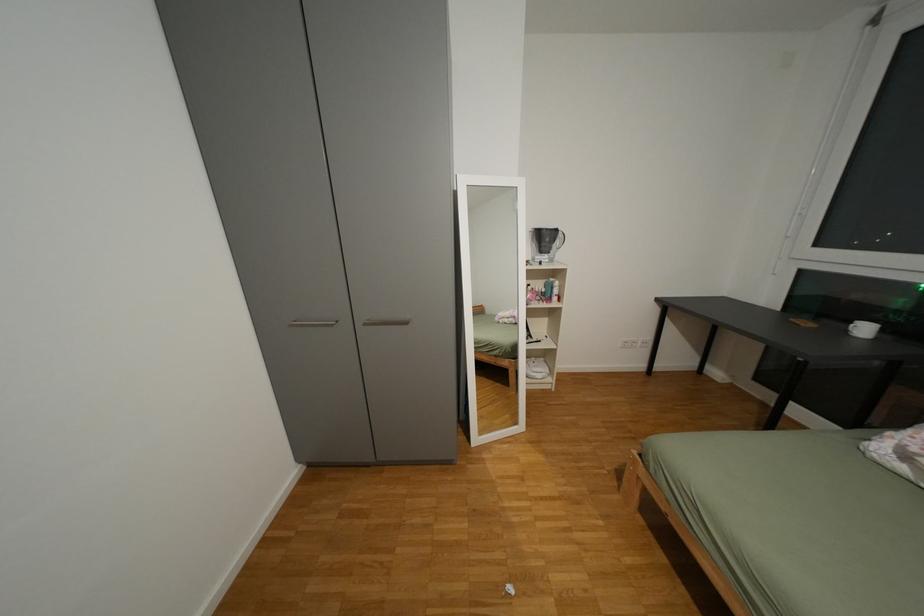
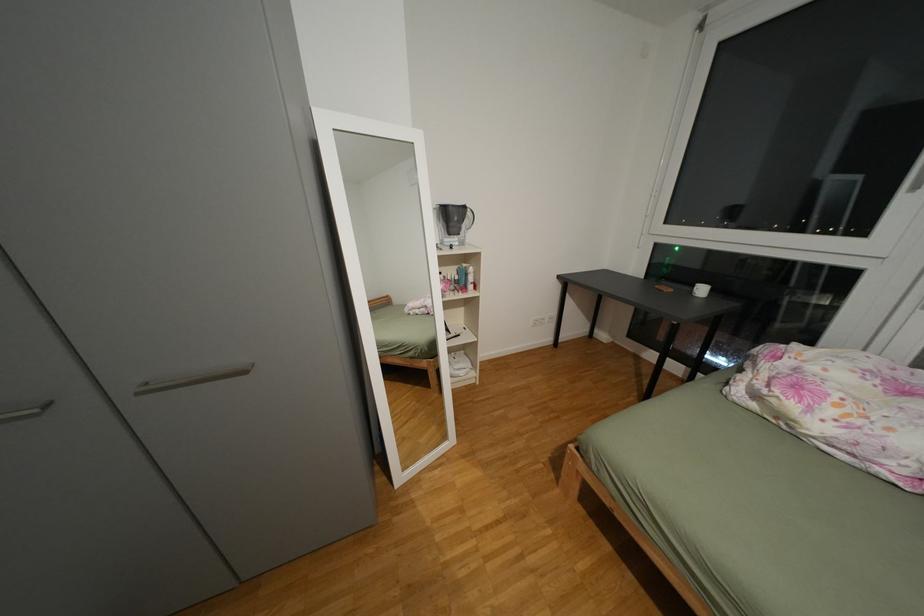
Question: What movement of the cameraman would produce the second image?

Choices:
 (A) Left
 (B) Right
 (C) Forward
 (D) Backward

Answer: (C)